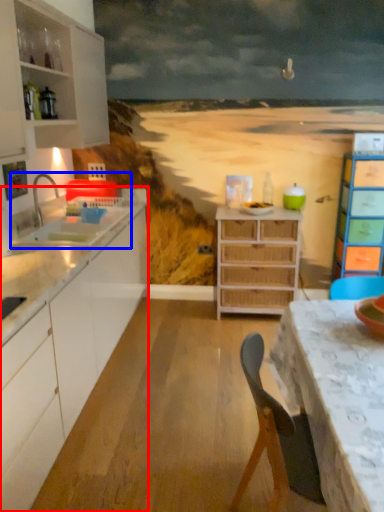
Question: Which of the following is the closest to the observer, cabinetry (highlighted by a red box) or sink (highlighted by a blue box)?

Choices:
 (A) cabinetry
 (B) sink

Answer: (A)